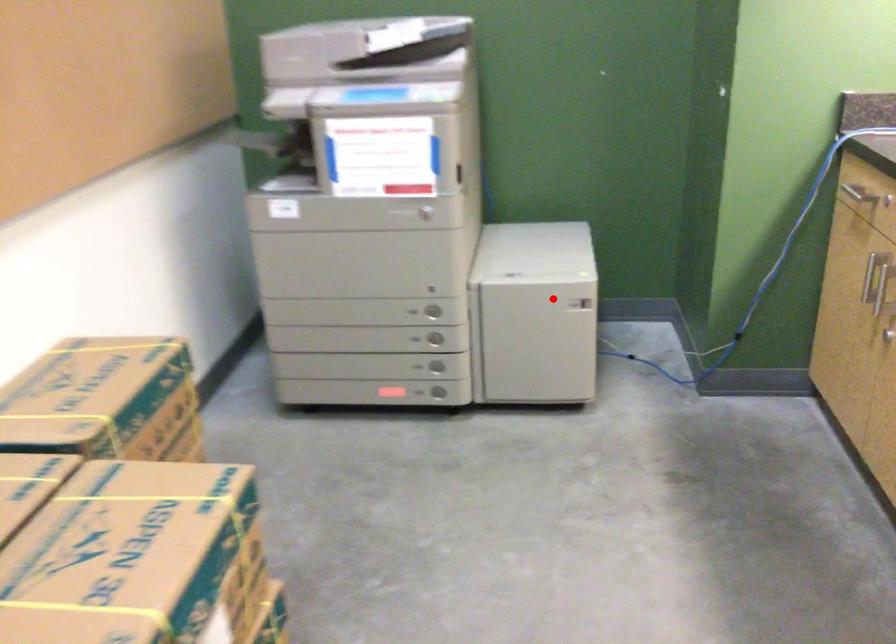
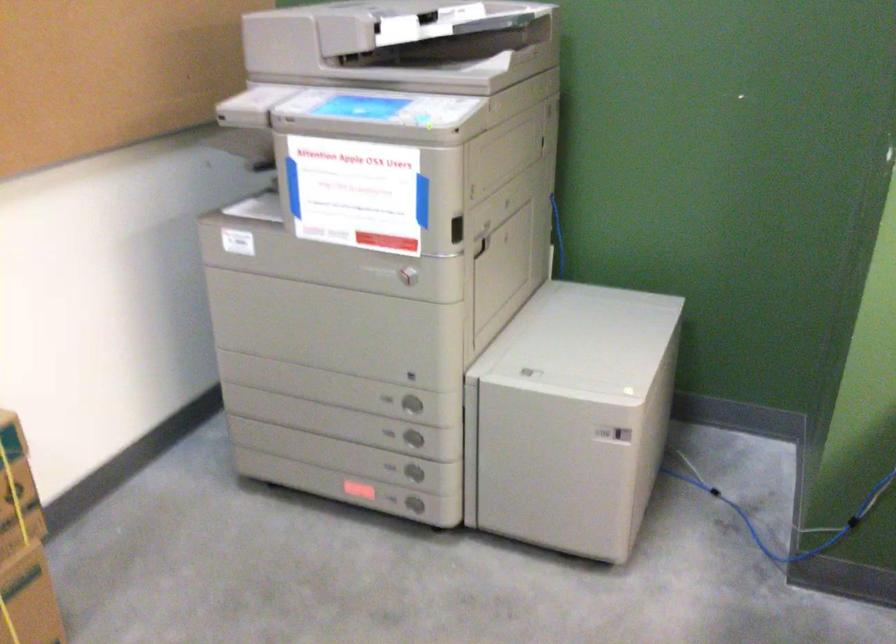
Where in the second image is the point corresponding to the highlighted location from the first image?

(572, 418)